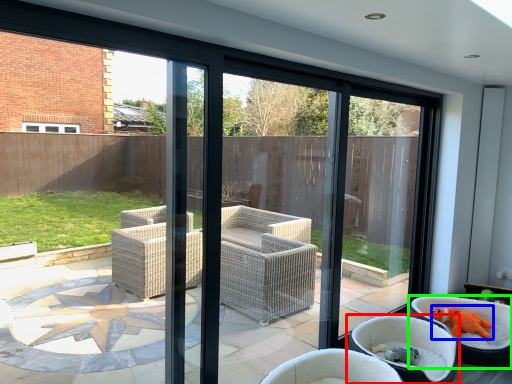
Question: Estimate the real-world distances between objects in this image. Which object is closer to chair (highlighted by a red box), animal (highlighted by a blue box) or chair (highlighted by a green box)?

Choices:
 (A) animal
 (B) chair

Answer: (B)